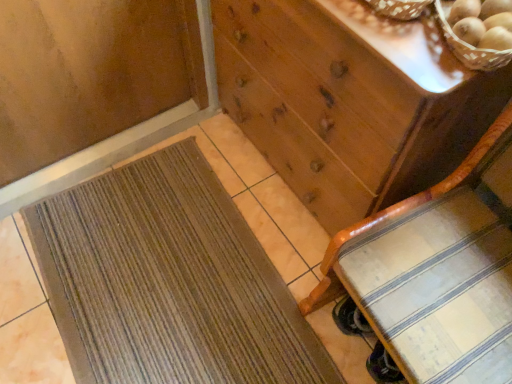
Question: From a real-world perspective, is brown textured mat at lower left positioned above or below wooden chest of drawers at center?

Choices:
 (A) below
 (B) above

Answer: (A)

Question: From the image's perspective, is brown textured mat at lower left positioned above or below wooden chest of drawers at center?

Choices:
 (A) below
 (B) above

Answer: (A)

Question: Estimate the real-world distances between objects in this image. Which object is closer to the wooden chest of drawers at center?

Choices:
 (A) brown textured mat at lower left
 (B) wooden woven basket at upper right
 (C) wooden chair at lower right

Answer: (C)

Question: Which of these objects is positioned closest to the wooden chair at lower right?

Choices:
 (A) brown textured mat at lower left
 (B) wooden chest of drawers at center
 (C) wooden woven basket at upper right

Answer: (B)